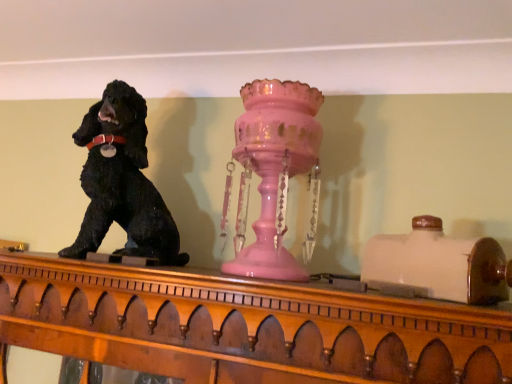
Question: Considering the positions of black matte dog at left and pink glass candle holder at center in the image, is black matte dog at left wider or thinner than pink glass candle holder at center?

Choices:
 (A) wide
 (B) thin

Answer: (A)

Question: Considering the positions of black matte dog at left and pink glass candle holder at center in the image, is black matte dog at left bigger or smaller than pink glass candle holder at center?

Choices:
 (A) small
 (B) big

Answer: (B)

Question: Is point (117, 87) closer or farther from the camera than point (244, 112)?

Choices:
 (A) closer
 (B) farther

Answer: (B)

Question: Considering the positions of pink glass candle holder at center and black matte dog at left in the image, is pink glass candle holder at center wider or thinner than black matte dog at left?

Choices:
 (A) wide
 (B) thin

Answer: (B)

Question: From the image's perspective, is pink glass candle holder at center positioned above or below black matte dog at left?

Choices:
 (A) above
 (B) below

Answer: (B)

Question: Considering the relative positions of pink glass candle holder at center and black matte dog at left in the image provided, is pink glass candle holder at center to the left or to the right of black matte dog at left?

Choices:
 (A) right
 (B) left

Answer: (A)

Question: In the image, is pink glass candle holder at center positioned in front of or behind black matte dog at left?

Choices:
 (A) behind
 (B) front

Answer: (B)